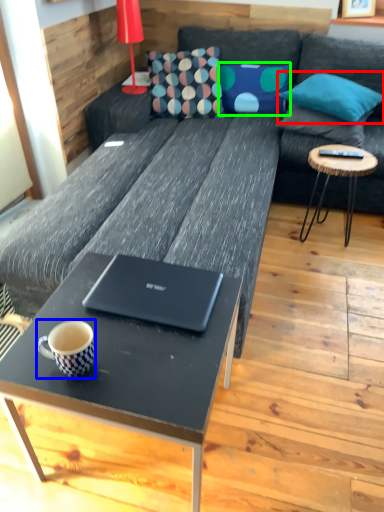
Question: Which object is the farthest from pillow (highlighted by a red box)? Choose among these: coffee cup (highlighted by a blue box) or pillow (highlighted by a green box).

Choices:
 (A) coffee cup
 (B) pillow

Answer: (A)